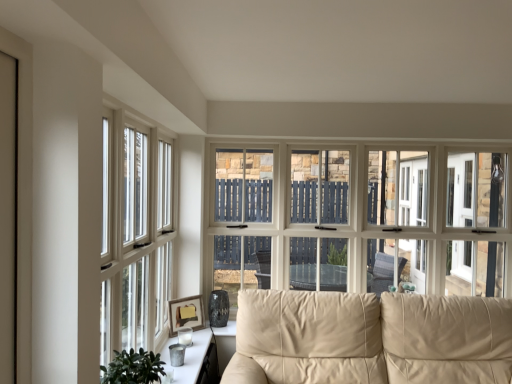
What are the coordinates of `green leafy plant at lower left` in the screenshot? It's located at (133, 368).

Locate an element on the screen. white wood window at left, acting as the second window starting from the right is located at coordinates (135, 236).

I want to click on beige leather couch at center, so coord(370,338).

Find the location of a particular element. This screenshot has width=512, height=384. matte white window at center, which is counted as the 2th window, starting from the left is located at coordinates (362, 220).

Is matte wooden picture frame at lower left turned away from metallic silver tray at lower center?

No, matte wooden picture frame at lower left is not facing away from metallic silver tray at lower center.

Where is `table located below the matte wooden picture frame at lower left (from the image's perspective)`? This screenshot has width=512, height=384. table located below the matte wooden picture frame at lower left (from the image's perspective) is located at coordinates (188, 357).

Is matte wooden picture frame at lower left far from metallic silver tray at lower center?

They are positioned close to each other.

Considering the sizes of objects matte wooden picture frame at lower left and metallic silver tray at lower center in the image provided, who is bigger, matte wooden picture frame at lower left or metallic silver tray at lower center?

With larger size is metallic silver tray at lower center.

Is white wood window at left, placed as the 2th window when sorted from back to front, oriented away from metallic silver tray at lower center?

white wood window at left, placed as the 2th window when sorted from back to front, does not have its back to metallic silver tray at lower center.

From a real-world perspective, between white wood window at left, which is counted as the first window, starting from the left, and metallic silver tray at lower center, who is vertically higher?

From a 3D spatial view, white wood window at left, which is counted as the first window, starting from the left, is above.

Is white wood window at left, which appears as the first window when viewed from the front, completely or partially outside of metallic silver tray at lower center?

Yes, white wood window at left, which appears as the first window when viewed from the front, is not within metallic silver tray at lower center.

Consider the image. Between white wood window at left, acting as the second window starting from the right, and metallic silver tray at lower center, which one has larger width?

metallic silver tray at lower center.

Between green leafy plant at lower left and beige leather couch at center, which one has more height?

Standing taller between the two is beige leather couch at center.

Is green leafy plant at lower left in front of or behind beige leather couch at center in the image?

Clearly, green leafy plant at lower left is in front of beige leather couch at center.

Is green leafy plant at lower left touching beige leather couch at center?

green leafy plant at lower left and beige leather couch at center are not in contact.

Which of these two, green leafy plant at lower left or beige leather couch at center, is thinner?

Thinner between the two is green leafy plant at lower left.

Is beige leather couch at center further to the viewer compared to matte white window at center, which appears as the 1th window when viewed from the right?

That is False.

Can you see beige leather couch at center touching matte white window at center, arranged as the 2th window when viewed from the front?

No, beige leather couch at center is not in contact with matte white window at center, arranged as the 2th window when viewed from the front.

Who is smaller, beige leather couch at center or matte white window at center, which is counted as the 2th window, starting from the left?

With smaller size is matte white window at center, which is counted as the 2th window, starting from the left.

Could you measure the distance between metallic silver tray at lower center and matte wooden picture frame at lower left?

metallic silver tray at lower center and matte wooden picture frame at lower left are 13.34 inches apart from each other.

Which of these two, metallic silver tray at lower center or matte wooden picture frame at lower left, is smaller?

matte wooden picture frame at lower left is smaller.

Which object is wider, metallic silver tray at lower center or matte wooden picture frame at lower left?

metallic silver tray at lower center.

From a real-world perspective, is metallic silver tray at lower center positioned above or below matte wooden picture frame at lower left?

Clearly, from a real-world perspective, metallic silver tray at lower center is below matte wooden picture frame at lower left.

Consider the image. Are matte wooden picture frame at lower left and matte white window at center, arranged as the 2th window when viewed from the front, located far from each other?

That's right, there is a large distance between matte wooden picture frame at lower left and matte white window at center, arranged as the 2th window when viewed from the front.

Between matte wooden picture frame at lower left and matte white window at center, arranged as the 2th window when viewed from the front, which one has more height?

With more height is matte white window at center, arranged as the 2th window when viewed from the front.

From the image's perspective, relative to matte white window at center, which appears as the 1th window when viewed from the right, is matte wooden picture frame at lower left above or below?

matte wooden picture frame at lower left is below matte white window at center, which appears as the 1th window when viewed from the right.

From the image's perspective, which one is positioned higher, green leafy plant at lower left or matte white window at center, the 1th window in the back-to-front sequence?

matte white window at center, the 1th window in the back-to-front sequence.

From a real-world perspective, is green leafy plant at lower left below matte white window at center, which appears as the 1th window when viewed from the right?

Yes.

Is green leafy plant at lower left not close to matte white window at center, which is counted as the 2th window, starting from the left?

Yes, green leafy plant at lower left is far from matte white window at center, which is counted as the 2th window, starting from the left.

Who is smaller, green leafy plant at lower left or matte white window at center, which is counted as the 2th window, starting from the left?

Smaller between the two is green leafy plant at lower left.

You are a GUI agent. You are given a task and a screenshot of the screen. Output one action in this format:
    pyautogui.click(x=<x>, y=<y>)
    Task: Click on the table in front of the matte wooden picture frame at lower left
    The image size is (512, 384).
    Given the screenshot: What is the action you would take?
    pyautogui.click(x=188, y=357)

From the image's perspective, starting from the metallic silver tray at lower center, which window is the 1st one above? Please provide its 2D coordinates.

[(135, 236)]

When comparing their distances from matte white window at center, the 1th window in the back-to-front sequence, does matte wooden picture frame at lower left or white wood window at left, which is counted as the first window, starting from the left, seem closer?

matte wooden picture frame at lower left.

Which object lies further to the anchor point white wood window at left, which appears as the first window when viewed from the front, metallic silver tray at lower center or beige leather couch at center?

Based on the image, beige leather couch at center appears to be further to white wood window at left, which appears as the first window when viewed from the front.

Estimate the real-world distances between objects in this image. Which object is closer to matte wooden picture frame at lower left, beige leather couch at center or white wood window at left, acting as the second window starting from the right?

white wood window at left, acting as the second window starting from the right, lies closer to matte wooden picture frame at lower left than the other object.

From the image, which object appears to be farther from beige leather couch at center, white wood window at left, acting as the second window starting from the right, or matte white window at center, the 1th window in the back-to-front sequence?

Among the two, white wood window at left, acting as the second window starting from the right, is located further to beige leather couch at center.

Looking at the image, which one is located closer to metallic silver tray at lower center, matte wooden picture frame at lower left or white wood window at left, which is counted as the first window, starting from the left?

matte wooden picture frame at lower left is positioned closer to the anchor metallic silver tray at lower center.

Considering their positions, is matte white window at center, arranged as the 2th window when viewed from the front, positioned closer to green leafy plant at lower left than matte wooden picture frame at lower left?

Based on the image, matte wooden picture frame at lower left appears to be nearer to green leafy plant at lower left.

When comparing their distances from white wood window at left, which is counted as the first window, starting from the left, does matte white window at center, arranged as the 2th window when viewed from the front, or beige leather couch at center seem closer?

Among the two, beige leather couch at center is located nearer to white wood window at left, which is counted as the first window, starting from the left.

From the image, which object appears to be nearer to beige leather couch at center, matte white window at center, which appears as the 1th window when viewed from the right, or matte wooden picture frame at lower left?

Based on the image, matte white window at center, which appears as the 1th window when viewed from the right, appears to be nearer to beige leather couch at center.

The width and height of the screenshot is (512, 384). What are the coordinates of `table between green leafy plant at lower left and matte wooden picture frame at lower left along the z-axis` in the screenshot? It's located at (188, 357).

Where is `studio couch between green leafy plant at lower left and matte white window at center, which appears as the 1th window when viewed from the right, in the front-back direction`? This screenshot has width=512, height=384. studio couch between green leafy plant at lower left and matte white window at center, which appears as the 1th window when viewed from the right, in the front-back direction is located at coordinates pos(370,338).

The width and height of the screenshot is (512, 384). What are the coordinates of `picture frame between white wood window at left, which is counted as the first window, starting from the left, and beige leather couch at center` in the screenshot? It's located at (186, 313).

Locate an element on the screen. The image size is (512, 384). window positioned between green leafy plant at lower left and matte wooden picture frame at lower left from near to far is located at coordinates (135, 236).